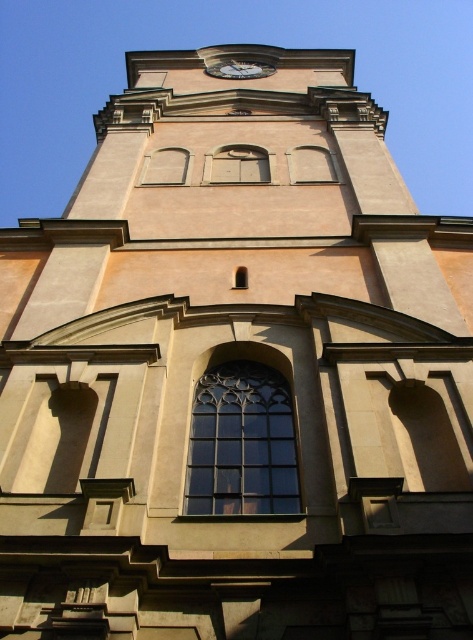
Question: Among these objects, which one is farthest from the camera?

Choices:
 (A) clear glass window at center
 (B) dark glass window at center
 (C) matte silver clock at upper center

Answer: (C)

Question: Considering the relative positions of dark glass window at center and clear glass window at center in the image provided, where is dark glass window at center located with respect to clear glass window at center?

Choices:
 (A) above
 (B) below

Answer: (B)

Question: Which of these objects is positioned farthest from the clear glass window at center?

Choices:
 (A) matte silver clock at upper center
 (B) matte glass window at center
 (C) matte glass window at upper center

Answer: (A)

Question: Which object is closer to the camera taking this photo?

Choices:
 (A) matte glass window at upper center
 (B) matte glass window at center
 (C) matte silver clock at upper center

Answer: (B)

Question: Does clear glass window at center have a smaller size compared to matte silver clock at upper center?

Choices:
 (A) no
 (B) yes

Answer: (B)

Question: Is clear glass window at center wider than matte silver clock at upper center?

Choices:
 (A) yes
 (B) no

Answer: (B)